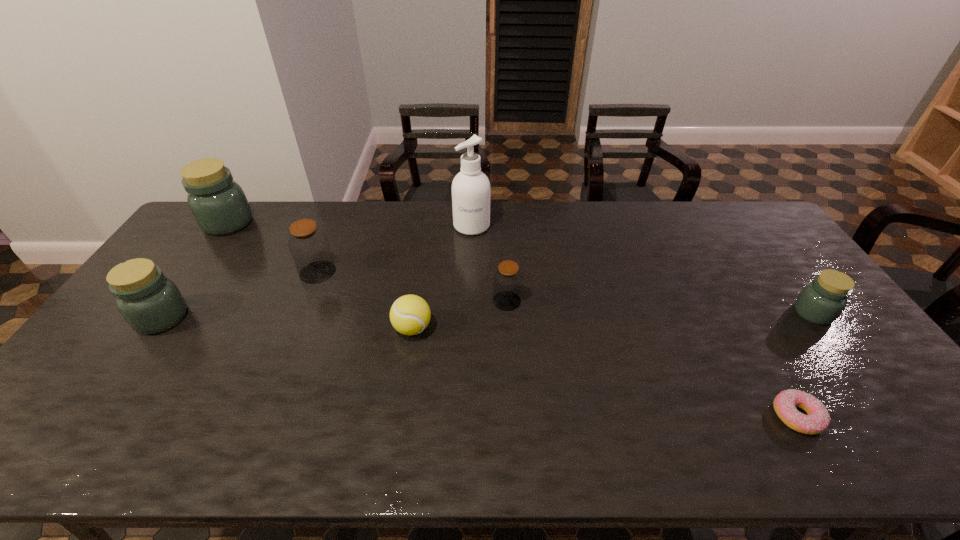
The image size is (960, 540). I want to click on vacant position in the image that satisfies the following two spatial constraints: 1. on the front side of the doughnut; 2. on the left side of the second shortest object, so click(399, 416).

Find the location of a particular element. vacant space that satisfies the following two spatial constraints: 1. on the front label of the cleansing agent; 2. on the left side of the rightmost green jar is located at coordinates (469, 313).

Find the location of a particular element. This screenshot has height=540, width=960. vacant space that satisfies the following two spatial constraints: 1. on the front side of the third farthest object; 2. on the left side of the nearest object is located at coordinates (x=260, y=416).